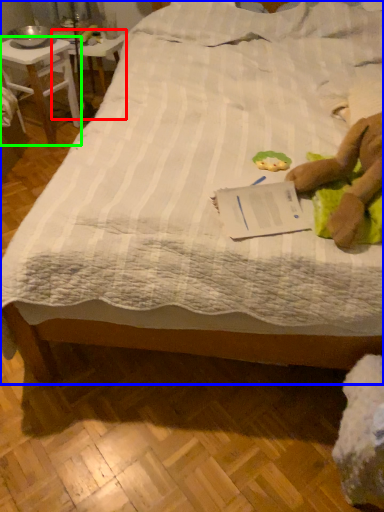
Question: Based on their relative distances, which object is farther from table (highlighted by a red box)? Choose from bed (highlighted by a blue box) and desk (highlighted by a green box).

Choices:
 (A) bed
 (B) desk

Answer: (A)